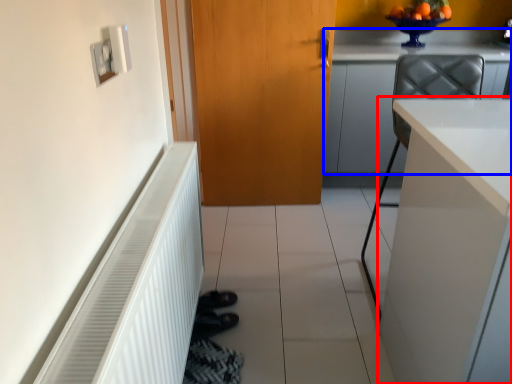
Question: Among these objects, which one is farthest to the camera, cabinetry (highlighted by a red box) or cabinetry (highlighted by a blue box)?

Choices:
 (A) cabinetry
 (B) cabinetry

Answer: (B)